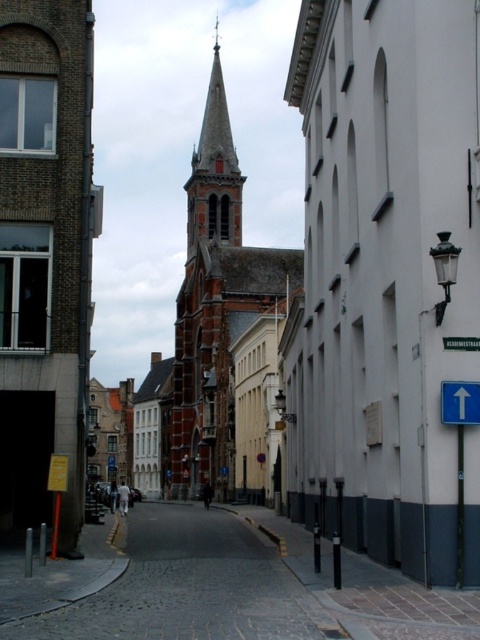
Question: Which point is farther to the camera?

Choices:
 (A) blue plastic sign at right
 (B) smooth white church at center
 (C) brick church at center

Answer: (C)

Question: Which object is positioned closest to the reddish-brown brick spire at center?

Choices:
 (A) blue plastic sign at right
 (B) smooth white church at center
 (C) red brick church at center

Answer: (C)

Question: Does red brick church at center have a lesser width compared to reddish-brown brick spire at center?

Choices:
 (A) yes
 (B) no

Answer: (B)

Question: Observing the image, what is the correct spatial positioning of smooth white church at center in reference to brick church at center?

Choices:
 (A) right
 (B) left

Answer: (A)

Question: From the image, what is the correct spatial relationship of smooth white church at center in relation to red brick church at center?

Choices:
 (A) left
 (B) right

Answer: (B)

Question: Which object appears closest to the camera in this image?

Choices:
 (A) reddish-brown brick spire at center
 (B) smooth white church at center
 (C) blue plastic sign at right
 (D) brick church at center

Answer: (C)